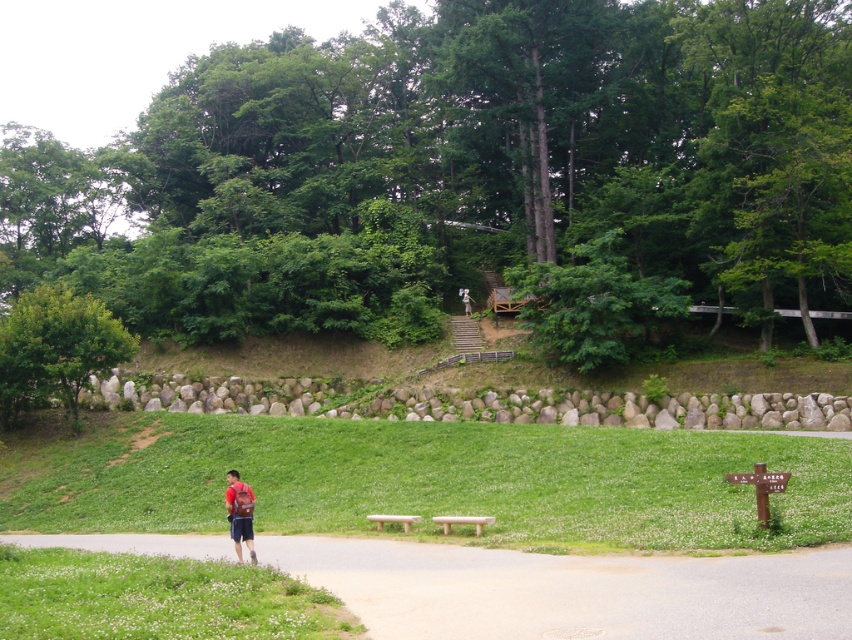
Question: Which point is farther to the camera?

Choices:
 (A) (580, 604)
 (B) (461, 289)

Answer: (B)

Question: Does green grassy at lower center have a smaller size compared to light brown wooden signpost at upper center?

Choices:
 (A) no
 (B) yes

Answer: (A)

Question: Is green grassy at lower center to the left of matte red backpack at lower left from the viewer's perspective?

Choices:
 (A) yes
 (B) no

Answer: (B)

Question: Among these points, which one is farthest from the camera?

Choices:
 (A) (15, 545)
 (B) (465, 301)

Answer: (B)

Question: Is green grassy at lower left thinner than green leafy tree at left?

Choices:
 (A) yes
 (B) no

Answer: (B)

Question: Which of the following is the farthest from the observer?

Choices:
 (A) (337, 625)
 (B) (468, 314)
 (C) (335, 461)
 (D) (38, 316)

Answer: (B)